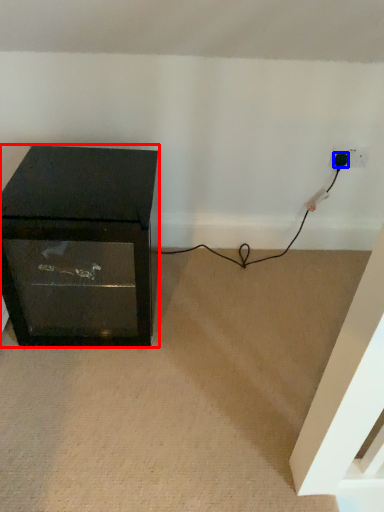
Question: Which object appears farthest to the camera in this image, furniture (highlighted by a red box) or plug (highlighted by a blue box)?

Choices:
 (A) furniture
 (B) plug

Answer: (B)